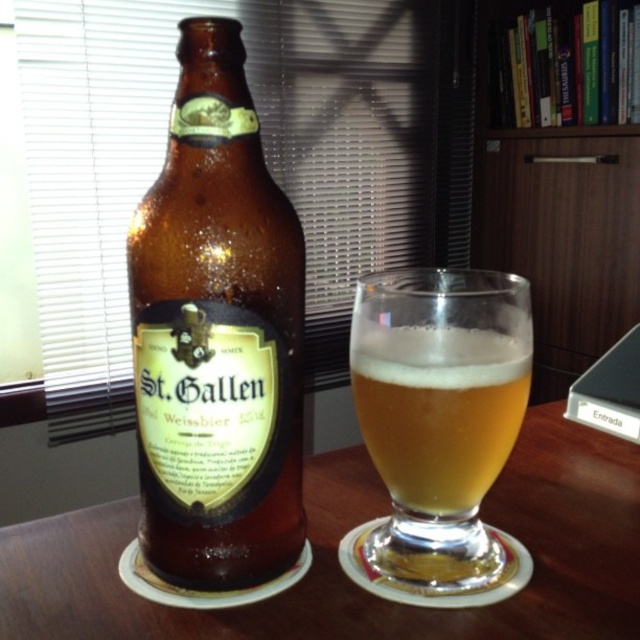
You are at a bar and want to pour yourself a glass of St. Gallen Weissbier. The bottle is located at point (216, 336). Can you reach it from your current position at the bar counter?

Point (216, 336) marks brown glass bottle at left, so yes, you can reach the brown glass bottle at left from your current position at the bar counter.

You are a bartender who needs to place a new order of St. Gallen Weissbier bottles and glasses on the brown wooden table at center. The delivery arrived with 12 bottles and 10 glasses. If you want to arrange them in a single row starting from the left edge of the table, how many items can you fit if each bottle takes up 12 cm and each glass takes up 8 cm of space, and the table is 1 meter long?

The brown wooden table at center is 1 meter long, which is 100 cm. Each bottle takes 12 cm and each glass takes 8 cm. To maximize the number of items, you should use as many glasses as possible since they take less space. Let x be the number of bottles and y the number of glasses. The total space used is 12x 8y 100. To maximize x y, minimize the space per item. Since glasses take less space, prioritize them. Let y 10, then 810 80 cm, leaving 20 cm. 20 cm can fit 1 bottle. So total items 10 1 11. However, we

You are organizing a small party and need to place the translucent glass beer at center on the wooden cabinet at upper right. Can you fit it there without moving any other items?

The translucent glass beer at center is to the left of the wooden cabinet at upper right, so it can be placed there as there is space available.